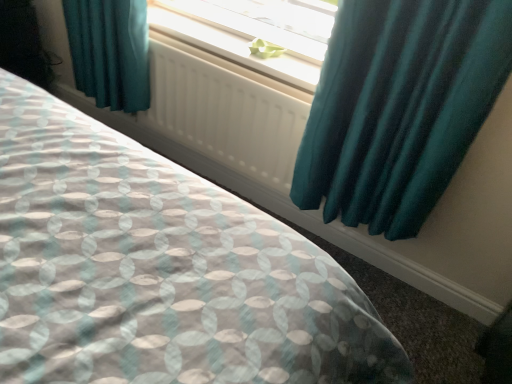
Locate an element on the screen. This screenshot has height=384, width=512. unoccupied region to the right of green paper at center is located at coordinates (294, 61).